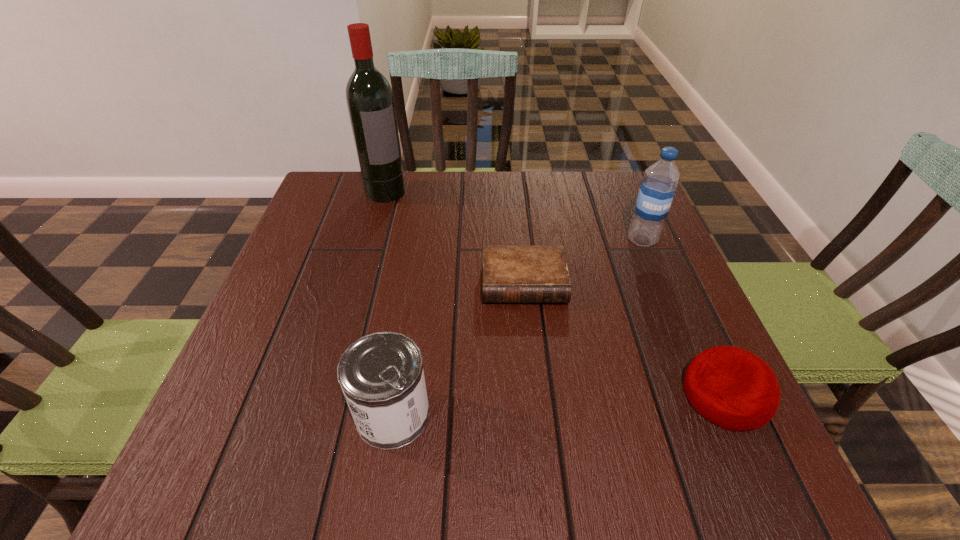
Identify the location of can. The image size is (960, 540). (381, 375).

Where is `the fourth tallest object`? the fourth tallest object is located at coordinates (733, 388).

What are the coordinates of `the third object from left to right` in the screenshot? It's located at (511, 274).

The image size is (960, 540). I want to click on diary, so click(511, 274).

The height and width of the screenshot is (540, 960). Identify the location of the farthest object. (370, 101).

Find the location of a particular element. the tallest object is located at coordinates (370, 101).

Locate an element on the screen. This screenshot has height=540, width=960. the fourth shortest object is located at coordinates (657, 189).

The image size is (960, 540). I want to click on the fourth nearest object, so click(x=657, y=189).

Locate an element on the screen. This screenshot has width=960, height=540. blank space located on the right of the can is located at coordinates (592, 414).

The image size is (960, 540). What are the coordinates of `free space located on the seat area of the second shortest object` in the screenshot? It's located at (492, 395).